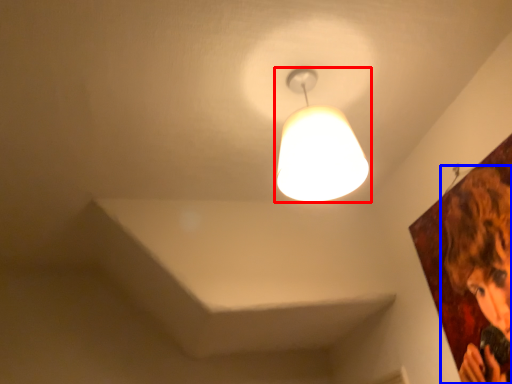
Question: Which of the following is the closest to the observer, lamp (highlighted by a red box) or person (highlighted by a blue box)?

Choices:
 (A) lamp
 (B) person

Answer: (B)